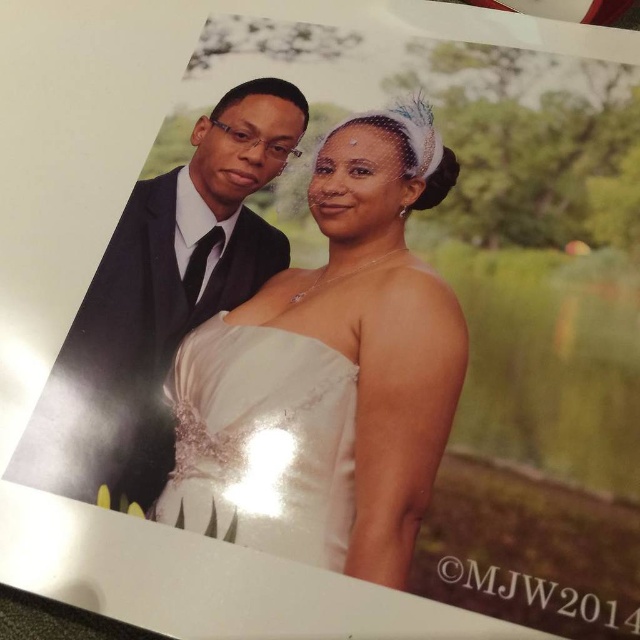
Question: Can you confirm if white satin dress at center is positioned above matte black suit at left?

Choices:
 (A) yes
 (B) no

Answer: (B)

Question: Which point is closer to the camera taking this photo?

Choices:
 (A) (268, 332)
 (B) (36, 449)

Answer: (B)

Question: Can you confirm if white satin dress at center is positioned above matte black suit at left?

Choices:
 (A) no
 (B) yes

Answer: (A)

Question: Does white satin dress at center appear on the right side of matte black suit at left?

Choices:
 (A) yes
 (B) no

Answer: (A)